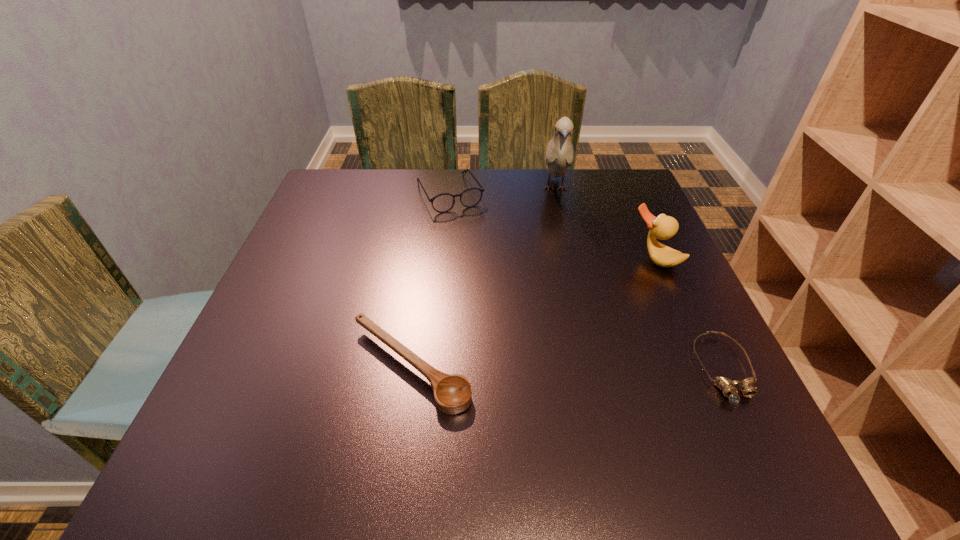
Find the location of a particular element. This screenshot has width=960, height=540. vacant space situated on the beak of the fourth shortest object is located at coordinates (592, 318).

At what (x,y) coordinates should I click in order to perform the action: click on free point located at the beak of the bird. Please return your answer as a coordinate pair (x, y). Looking at the image, I should click on (562, 318).

You are a GUI agent. You are given a task and a screenshot of the screen. Output one action in this format:
    pyautogui.click(x=<x>, y=<y>)
    Task: Click on the vacant space positioned at the beak of the bird
    The image size is (960, 540).
    Given the screenshot: What is the action you would take?
    pyautogui.click(x=559, y=239)

At what (x,y) coordinates should I click in order to perform the action: click on free point located 0.270m at the beak of the bird. Please return your answer as a coordinate pair (x, y). The width and height of the screenshot is (960, 540). Looking at the image, I should click on (560, 278).

At what (x,y) coordinates should I click in order to perform the action: click on vacant space located on the front-facing side of the third shortest object. Please return your answer as a coordinate pair (x, y). The height and width of the screenshot is (540, 960). Looking at the image, I should click on (511, 302).

Identify the location of vacant space located 0.190m on the front-facing side of the third shortest object. Image resolution: width=960 pixels, height=540 pixels. (x=486, y=258).

Locate an element on the screen. This screenshot has width=960, height=540. vacant space located 0.310m on the front-facing side of the third shortest object is located at coordinates pos(506,293).

The width and height of the screenshot is (960, 540). I want to click on bird located at the far edge, so click(559, 155).

The image size is (960, 540). I want to click on spectacles that is positioned at the far edge, so click(x=442, y=203).

Where is `wooden spoon that is at the near edge`? This screenshot has height=540, width=960. wooden spoon that is at the near edge is located at coordinates (452, 393).